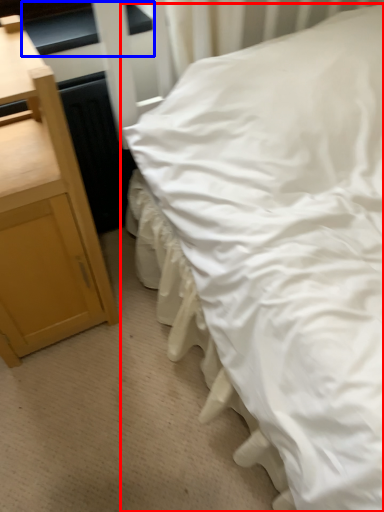
Question: Which of the following is the closest to the observer, bed (highlighted by a red box) or window sill (highlighted by a blue box)?

Choices:
 (A) bed
 (B) window sill

Answer: (A)